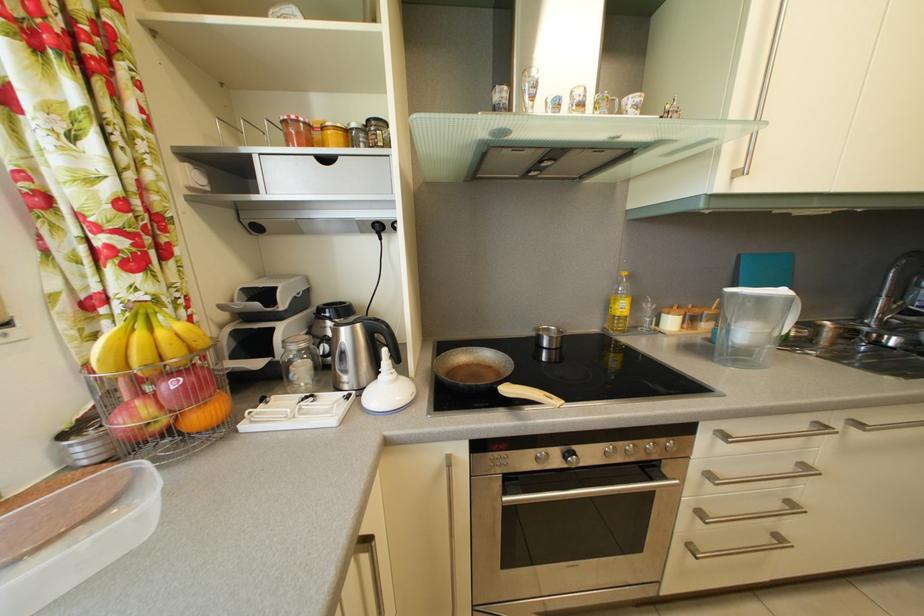
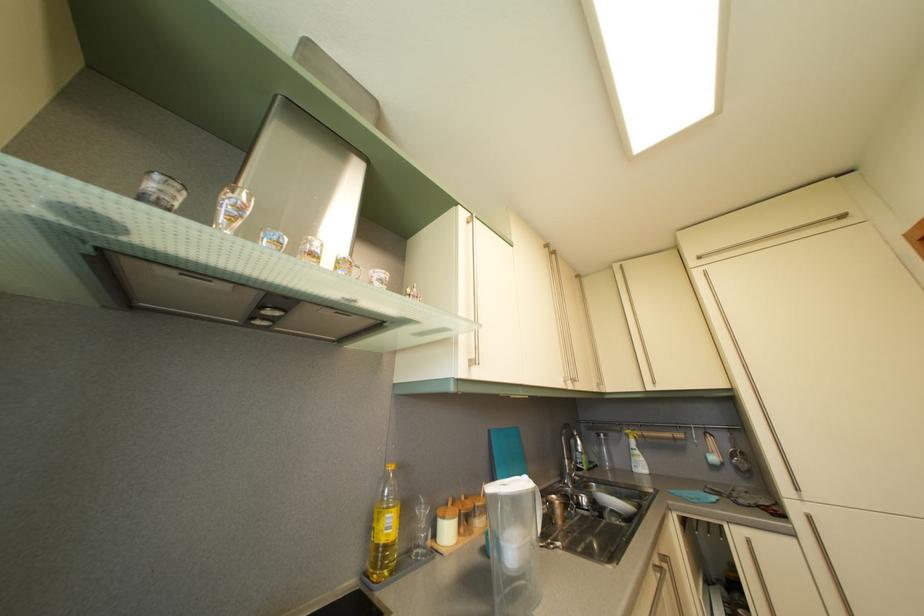
In the second image, find the point that corresponds to pixel 514 95 in the first image.

(186, 193)